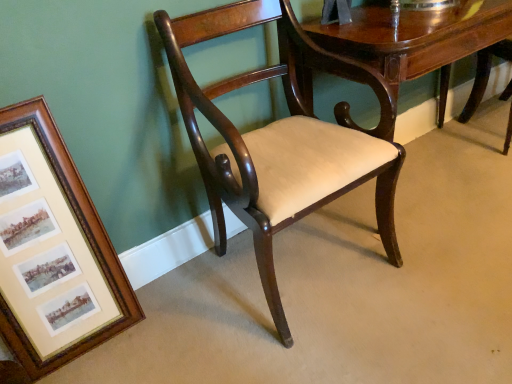
Question: From the image's perspective, would you say wooden framed prints at left is positioned over mahogany wood table at center?

Choices:
 (A) no
 (B) yes

Answer: (A)

Question: Is wooden framed prints at left to the left of mahogany wood table at center from the viewer's perspective?

Choices:
 (A) no
 (B) yes

Answer: (B)

Question: Can you confirm if wooden framed prints at left is thinner than mahogany wood table at center?

Choices:
 (A) yes
 (B) no

Answer: (A)

Question: Is wooden framed prints at left oriented away from mahogany wood table at center?

Choices:
 (A) no
 (B) yes

Answer: (A)

Question: Considering the relative sizes of wooden framed prints at left and mahogany wood table at center in the image provided, is wooden framed prints at left bigger than mahogany wood table at center?

Choices:
 (A) no
 (B) yes

Answer: (A)

Question: From a real-world perspective, is wooden framed prints at left positioned under mahogany wood table at center based on gravity?

Choices:
 (A) yes
 (B) no

Answer: (B)

Question: Considering the relative positions of mahogany wood table at center and wooden framed prints at left in the image provided, is mahogany wood table at center to the left of wooden framed prints at left from the viewer's perspective?

Choices:
 (A) no
 (B) yes

Answer: (A)

Question: Is mahogany wood table at center beside wooden framed prints at left?

Choices:
 (A) yes
 (B) no

Answer: (B)

Question: Does mahogany wood table at center have a greater width compared to wooden framed prints at left?

Choices:
 (A) no
 (B) yes

Answer: (B)

Question: From a real-world perspective, is mahogany wood table at center positioned under wooden framed prints at left based on gravity?

Choices:
 (A) no
 (B) yes

Answer: (B)

Question: Is mahogany wood table at center in front of wooden framed prints at left?

Choices:
 (A) no
 (B) yes

Answer: (A)

Question: From the image's perspective, is mahogany wood table at center under wooden framed prints at left?

Choices:
 (A) no
 (B) yes

Answer: (A)

Question: Can you confirm if mahogany wood chair at center is smaller than wooden framed prints at left?

Choices:
 (A) no
 (B) yes

Answer: (A)